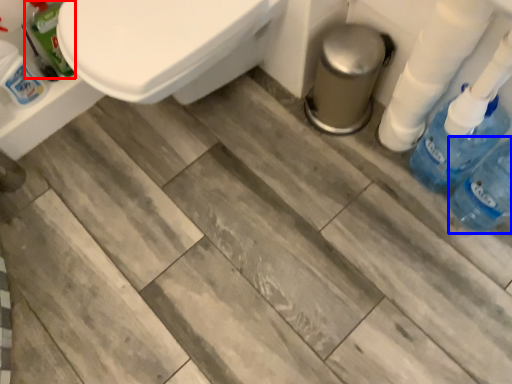
Question: Among these objects, which one is nearest to the camera, cleaning product (highlighted by a red box) or bottle (highlighted by a blue box)?

Choices:
 (A) cleaning product
 (B) bottle

Answer: (B)